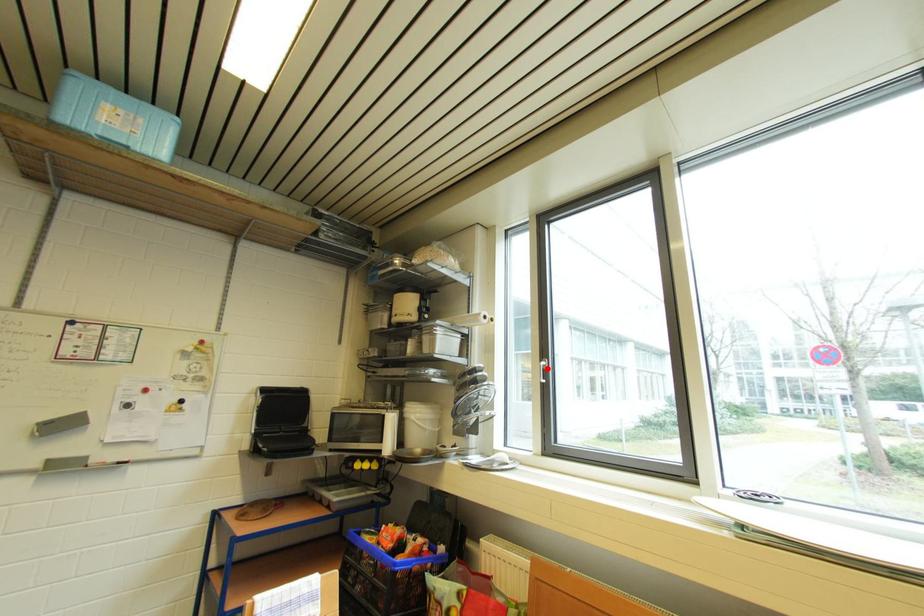
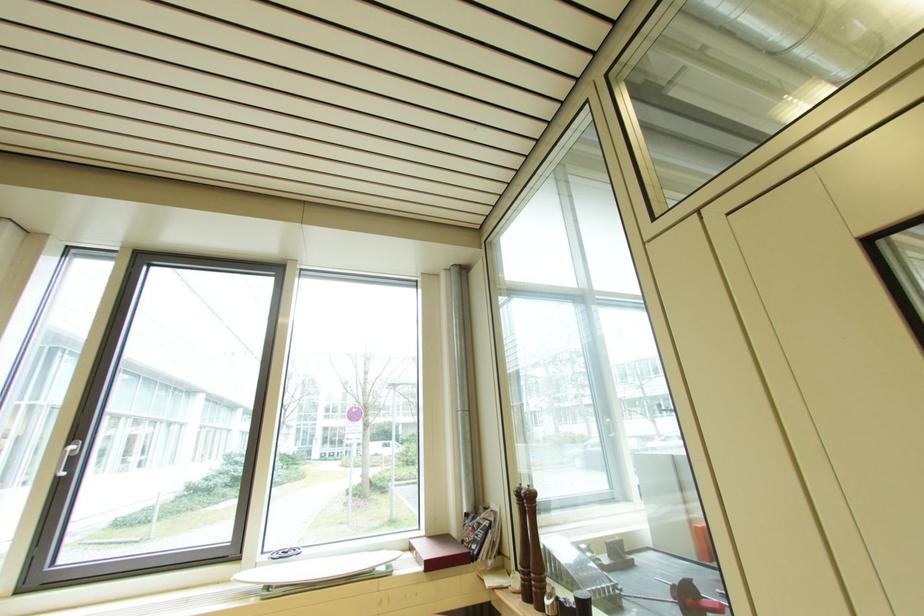
In the second image, find the point that corresponds to the highlighted location in the first image.

(73, 455)